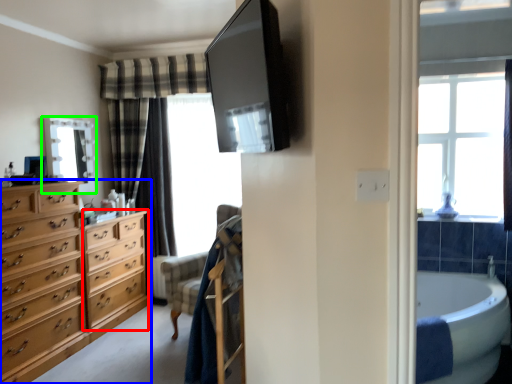
Question: Considering the real-world distances, which object is farthest from cabinetry (highlighted by a red box)? chest of drawers (highlighted by a blue box) or mirror (highlighted by a green box)?

Choices:
 (A) chest of drawers
 (B) mirror

Answer: (B)